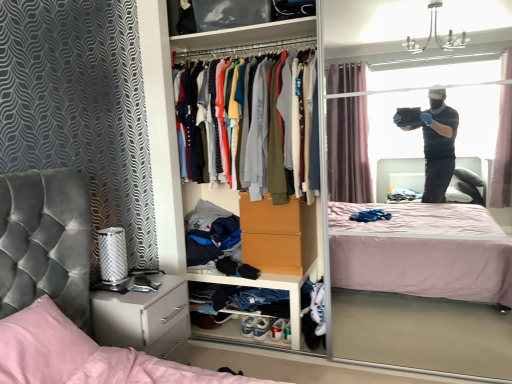
Question: Is the depth of white leather sneakers at lower center, arranged as the 1th footwear when viewed from the left, less than that of white matte cabinet at lower center?

Choices:
 (A) yes
 (B) no

Answer: (B)

Question: From the image's perspective, is white leather sneakers at lower center, positioned as the 2th footwear in right-to-left order, below white matte cabinet at lower center?

Choices:
 (A) yes
 (B) no

Answer: (A)

Question: From the image's perspective, is white leather sneakers at lower center, arranged as the 1th footwear when viewed from the left, on white matte cabinet at lower center?

Choices:
 (A) no
 (B) yes

Answer: (A)

Question: Could you tell me if white leather sneakers at lower center, positioned as the 2th footwear in right-to-left order, is turned towards white matte cabinet at lower center?

Choices:
 (A) no
 (B) yes

Answer: (B)

Question: Considering the relative sizes of white leather sneakers at lower center, positioned as the 2th footwear in right-to-left order, and white matte cabinet at lower center in the image provided, is white leather sneakers at lower center, positioned as the 2th footwear in right-to-left order, smaller than white matte cabinet at lower center?

Choices:
 (A) no
 (B) yes

Answer: (B)

Question: Can you confirm if white leather sneakers at lower center, arranged as the 1th footwear when viewed from the left, is taller than white matte cabinet at lower center?

Choices:
 (A) no
 (B) yes

Answer: (A)

Question: Is white leather sneakers at lower center, marked as the first footwear in a right-to-left arrangement, not inside pink satin pillow at lower left?

Choices:
 (A) no
 (B) yes

Answer: (B)

Question: Is white leather sneakers at lower center, placed as the second footwear when sorted from left to right, wider than pink satin pillow at lower left?

Choices:
 (A) no
 (B) yes

Answer: (A)

Question: From a real-world perspective, is white leather sneakers at lower center, placed as the second footwear when sorted from left to right, under pink satin pillow at lower left?

Choices:
 (A) yes
 (B) no

Answer: (A)

Question: Is white leather sneakers at lower center, marked as the first footwear in a right-to-left arrangement, bigger than pink satin pillow at lower left?

Choices:
 (A) yes
 (B) no

Answer: (B)

Question: Is white leather sneakers at lower center, placed as the second footwear when sorted from left to right, positioned behind pink satin pillow at lower left?

Choices:
 (A) no
 (B) yes

Answer: (B)

Question: Is white leather sneakers at lower center, placed as the second footwear when sorted from left to right, far away from pink satin pillow at lower left?

Choices:
 (A) no
 (B) yes

Answer: (B)

Question: Considering the relative positions of pink satin pillow at lower left and white glossy nightstand at lower left in the image provided, is pink satin pillow at lower left to the left of white glossy nightstand at lower left from the viewer's perspective?

Choices:
 (A) yes
 (B) no

Answer: (A)